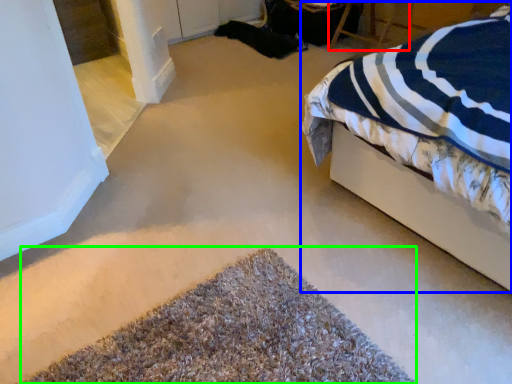
Question: Which object is the farthest from chair (highlighted by a red box)? Choose among these: bed (highlighted by a blue box) or door (highlighted by a green box).

Choices:
 (A) bed
 (B) door

Answer: (B)